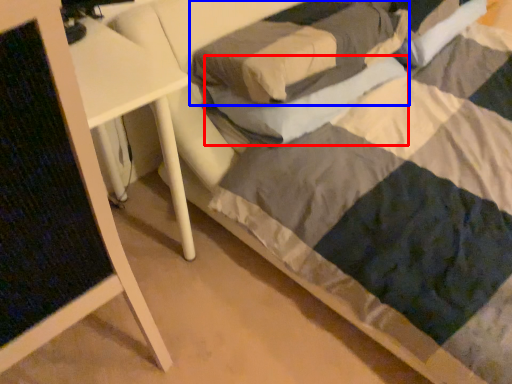
Question: Among these objects, which one is farthest to the camera, pillow (highlighted by a red box) or pillow (highlighted by a blue box)?

Choices:
 (A) pillow
 (B) pillow

Answer: (A)